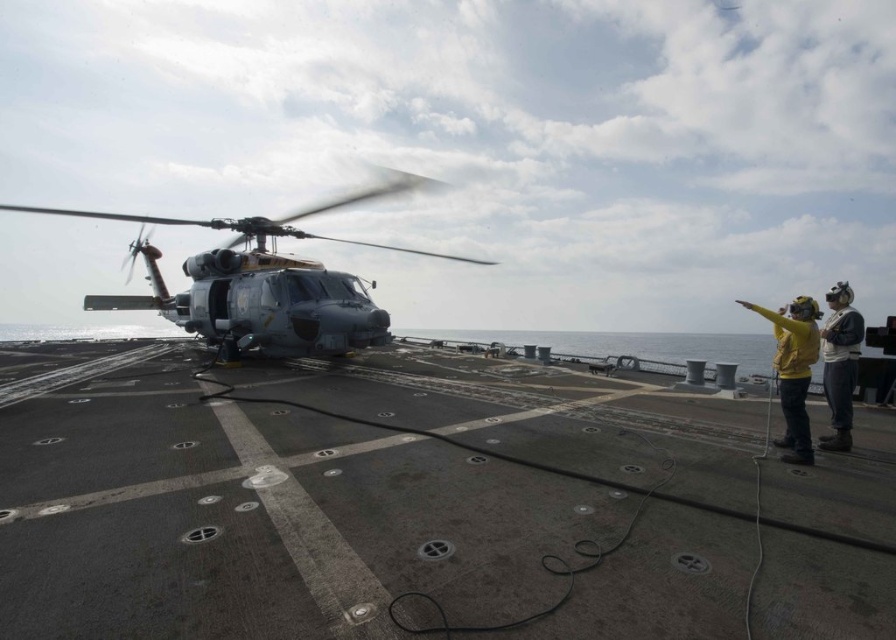
Question: Which object appears closest to the camera in this image?

Choices:
 (A) metallic gray helicopter at center
 (B) yellow fabric jacket at right

Answer: (B)

Question: Estimate the real-world distances between objects in this image. Which object is farther from the yellow matte jacket at right?

Choices:
 (A) metallic gray helicopter at center
 (B) yellow fabric jacket at right

Answer: (A)

Question: Is metallic gray helicopter at center closer to camera compared to yellow fabric jacket at right?

Choices:
 (A) yes
 (B) no

Answer: (B)

Question: Is metallic gray helicopter at center smaller than yellow matte jacket at right?

Choices:
 (A) yes
 (B) no

Answer: (B)

Question: Is metallic gray helicopter at center to the left of yellow matte jacket at right from the viewer's perspective?

Choices:
 (A) no
 (B) yes

Answer: (B)

Question: Among these objects, which one is farthest from the camera?

Choices:
 (A) yellow fabric jacket at right
 (B) metallic gray helicopter at center

Answer: (B)